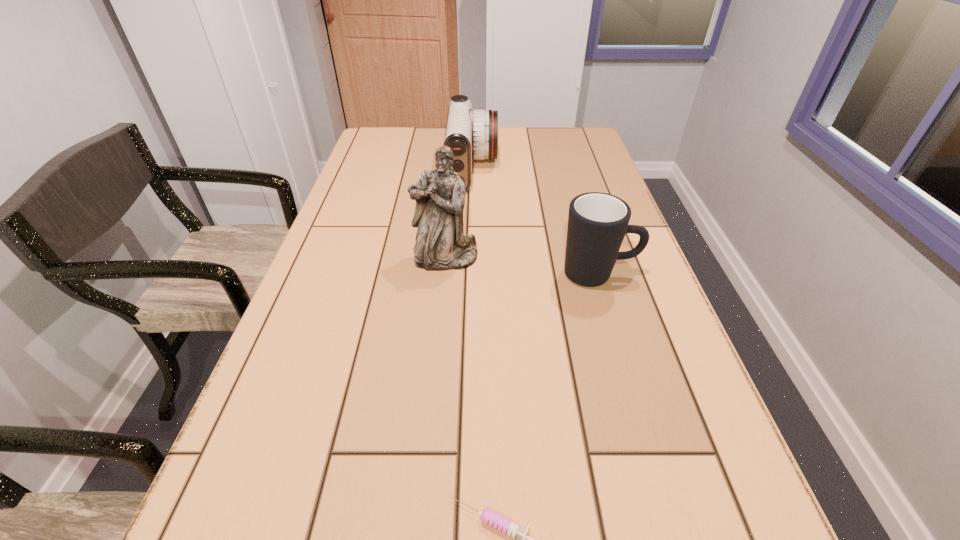
In order to click on blank space that satisfies the following two spatial constraints: 1. on the surface of the camcorder; 2. on the front-facing side of the tallest object in this screenshot , I will do `click(470, 258)`.

Locate an element on the screen. vacant space that satisfies the following two spatial constraints: 1. on the surface of the farthest object; 2. on the front-facing side of the figurine is located at coordinates (470, 258).